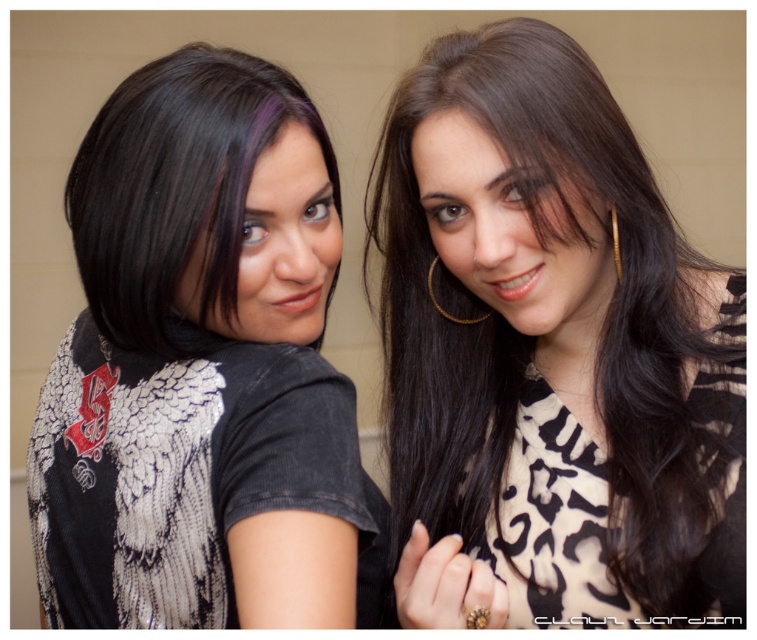
You are a photographer setting up for a portrait shoot. You need to position a spotlight so it illuminates both the black printed shirt at upper right and the gold metallic hoop earring at upper center. Based on their positions, which object should be placed closer to the left side of the spotlight to ensure even lighting?

The black printed shirt at upper right should be placed closer to the left side of the spotlight because it is positioned to the left of the gold metallic hoop earring at upper center, so aligning it this way will help both objects receive balanced illumination.

You are standing in front of the image and want to touch the point at coordinates point (170, 228). If your arm can reach up to 24 inches, can you reach it?

The point (170, 228) is 23.10 inches away from the viewer, so yes, you can reach it with your arm that can extend up to 24 inches.